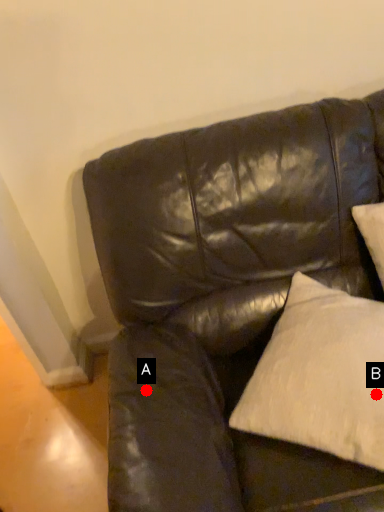
Question: Two points are circled on the image, labeled by A and B beside each circle. Which point is closer to the camera taking this photo?

Choices:
 (A) A is closer
 (B) B is closer

Answer: (B)